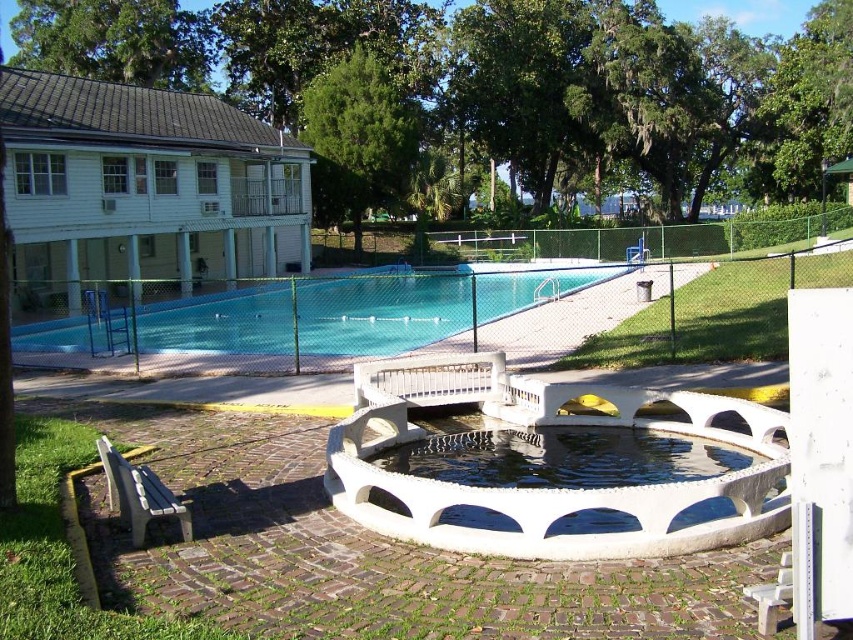
Question: Is white smooth fountain at center below blue smooth pool at center?

Choices:
 (A) no
 (B) yes

Answer: (B)

Question: Which point is farther to the camera?

Choices:
 (A) white smooth fountain at center
 (B) blue smooth pool at center

Answer: (B)

Question: Is white smooth fountain at center thinner than blue smooth pool at center?

Choices:
 (A) no
 (B) yes

Answer: (B)

Question: Can you confirm if white smooth fountain at center is positioned to the right of blue smooth pool at center?

Choices:
 (A) no
 (B) yes

Answer: (B)

Question: Among these objects, which one is farthest from the camera?

Choices:
 (A) white smooth fountain at center
 (B) blue smooth pool at center

Answer: (B)